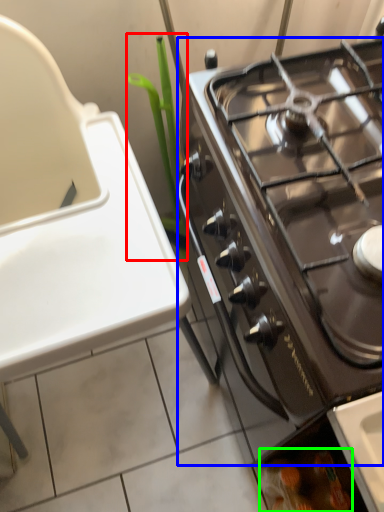
Question: Considering the real-world distances, which object is closest to plant (highlighted by a red box)? gas stove (highlighted by a blue box) or food (highlighted by a green box).

Choices:
 (A) gas stove
 (B) food

Answer: (A)